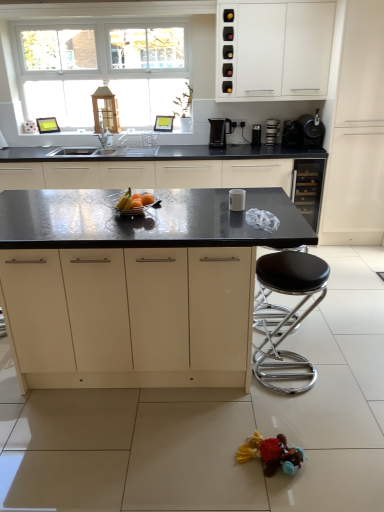
Identify the location of free region under black plastic coffee maker at upper right, which is the 4th appliance from left to right (from a real-world perspective). (296, 144).